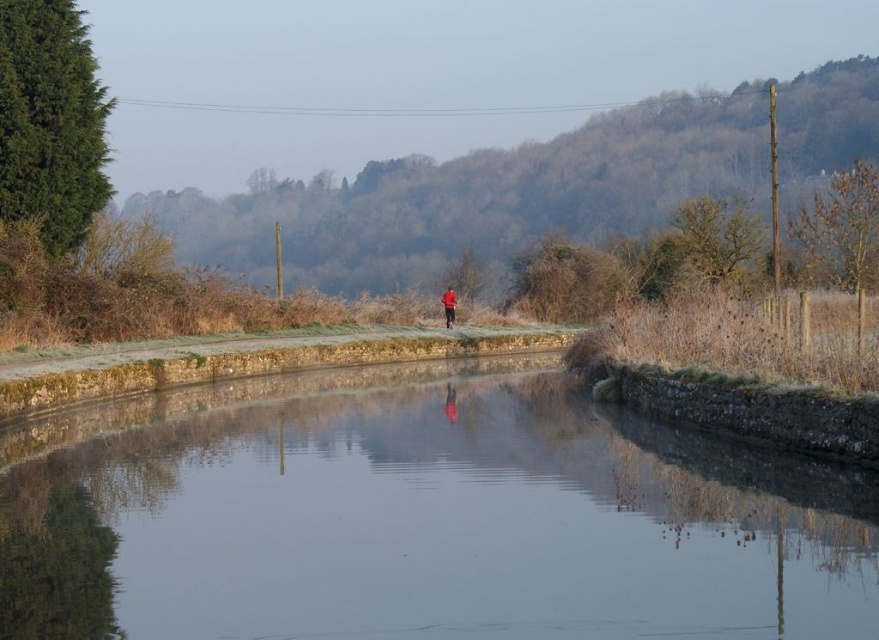
Question: Which of the following is the farthest from the observer?

Choices:
 (A) (253, 428)
 (B) (445, 307)

Answer: (B)

Question: In this image, where is clear glass water at center located relative to red matte jacket at center?

Choices:
 (A) below
 (B) above

Answer: (A)

Question: In this image, where is clear glass water at center located relative to red matte jacket at center?

Choices:
 (A) left
 (B) right

Answer: (A)

Question: Where is clear glass water at center located in relation to red matte jacket at center in the image?

Choices:
 (A) right
 (B) left

Answer: (B)